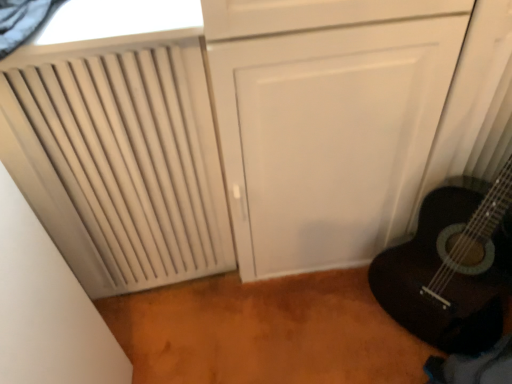
Question: From a real-world perspective, is black mesh curtain at upper left located higher than beige matte radiator at left?

Choices:
 (A) no
 (B) yes

Answer: (B)

Question: Does black mesh curtain at upper left have a smaller size compared to beige matte radiator at left?

Choices:
 (A) yes
 (B) no

Answer: (A)

Question: Is black mesh curtain at upper left positioned in front of beige matte radiator at left?

Choices:
 (A) no
 (B) yes

Answer: (B)

Question: Considering the relative positions of black mesh curtain at upper left and beige matte radiator at left in the image provided, is black mesh curtain at upper left to the left of beige matte radiator at left from the viewer's perspective?

Choices:
 (A) yes
 (B) no

Answer: (B)

Question: Is black mesh curtain at upper left outside beige matte radiator at left?

Choices:
 (A) yes
 (B) no

Answer: (A)

Question: Considering the relative sizes of black mesh curtain at upper left and beige matte radiator at left in the image provided, is black mesh curtain at upper left taller than beige matte radiator at left?

Choices:
 (A) no
 (B) yes

Answer: (A)

Question: Is white textured window at upper left wider than black mesh curtain at upper left?

Choices:
 (A) no
 (B) yes

Answer: (B)

Question: Does white textured window at upper left have a larger size compared to black mesh curtain at upper left?

Choices:
 (A) no
 (B) yes

Answer: (B)

Question: Is white textured window at upper left facing towards black mesh curtain at upper left?

Choices:
 (A) no
 (B) yes

Answer: (A)

Question: Is white textured window at upper left placed right next to black mesh curtain at upper left?

Choices:
 (A) yes
 (B) no

Answer: (A)

Question: Is white textured window at upper left looking in the opposite direction of black mesh curtain at upper left?

Choices:
 (A) yes
 (B) no

Answer: (B)

Question: Is white textured window at upper left smaller than black mesh curtain at upper left?

Choices:
 (A) yes
 (B) no

Answer: (B)

Question: Considering the relative sizes of beige matte radiator at left and white textured window at upper left in the image provided, is beige matte radiator at left thinner than white textured window at upper left?

Choices:
 (A) yes
 (B) no

Answer: (A)